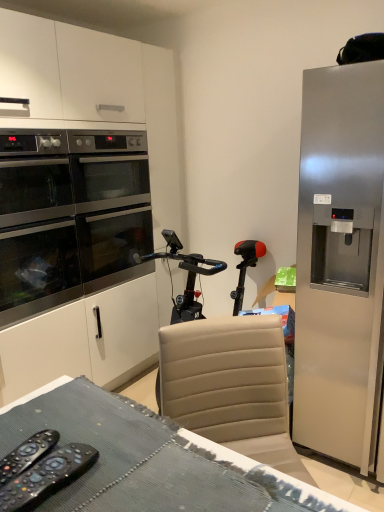
Question: Is stainless steel oven at left oriented away from black plastic remote control at lower left, the second remote control when ordered from right to left?

Choices:
 (A) yes
 (B) no

Answer: (B)

Question: Is stainless steel oven at left positioned in front of black plastic remote control at lower left, which ranks as the first remote control in left-to-right order?

Choices:
 (A) yes
 (B) no

Answer: (B)

Question: Would you say stainless steel oven at left is outside black plastic remote control at lower left, the second remote control when ordered from right to left?

Choices:
 (A) no
 (B) yes

Answer: (B)

Question: Considering the relative positions of stainless steel oven at left and black plastic remote control at lower left, the second remote control when ordered from right to left, in the image provided, is stainless steel oven at left to the left of black plastic remote control at lower left, the second remote control when ordered from right to left, from the viewer's perspective?

Choices:
 (A) yes
 (B) no

Answer: (A)

Question: Is stainless steel oven at left positioned behind black plastic remote control at lower left, the second remote control when ordered from right to left?

Choices:
 (A) yes
 (B) no

Answer: (A)

Question: Looking at their shapes, would you say satin silver refrigerator at right is wider or thinner than black plastic remote controls at lower left, the 1th remote control positioned from the right?

Choices:
 (A) wide
 (B) thin

Answer: (A)

Question: Looking at the image, does satin silver refrigerator at right seem bigger or smaller compared to black plastic remote controls at lower left, which ranks as the 2th remote control in left-to-right order?

Choices:
 (A) big
 (B) small

Answer: (A)

Question: In the image, is satin silver refrigerator at right positioned in front of or behind black plastic remote controls at lower left, the 1th remote control positioned from the right?

Choices:
 (A) behind
 (B) front

Answer: (A)

Question: Considering the positions of satin silver refrigerator at right and black plastic remote controls at lower left, which ranks as the 2th remote control in left-to-right order, in the image, is satin silver refrigerator at right taller or shorter than black plastic remote controls at lower left, which ranks as the 2th remote control in left-to-right order,?

Choices:
 (A) tall
 (B) short

Answer: (A)

Question: Is satin silver refrigerator at right in front of or behind stainless steel oven at left in the image?

Choices:
 (A) behind
 (B) front

Answer: (B)

Question: Based on their sizes in the image, would you say satin silver refrigerator at right is bigger or smaller than stainless steel oven at left?

Choices:
 (A) big
 (B) small

Answer: (A)

Question: From the image's perspective, relative to stainless steel oven at left, is satin silver refrigerator at right above or below?

Choices:
 (A) below
 (B) above

Answer: (A)

Question: Considering the positions of satin silver refrigerator at right and stainless steel oven at left in the image, is satin silver refrigerator at right wider or thinner than stainless steel oven at left?

Choices:
 (A) wide
 (B) thin

Answer: (A)

Question: Is black plastic remote control at lower left, which ranks as the first remote control in left-to-right order, in front of or behind satin silver refrigerator at right in the image?

Choices:
 (A) front
 (B) behind

Answer: (A)

Question: Is black plastic remote control at lower left, which ranks as the first remote control in left-to-right order, inside or outside of satin silver refrigerator at right?

Choices:
 (A) inside
 (B) outside

Answer: (B)